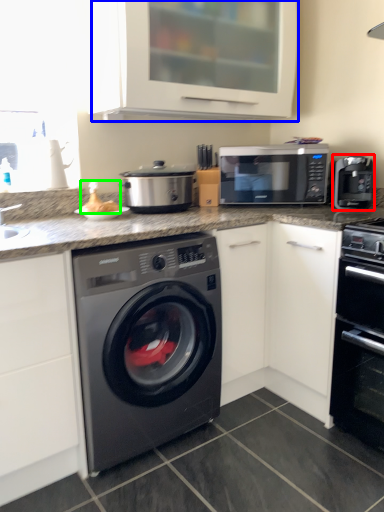
Question: Which object is positioned farthest from coffee machine (highlighted by a red box)? Select from cabinetry (highlighted by a blue box) and food (highlighted by a green box).

Choices:
 (A) cabinetry
 (B) food

Answer: (B)